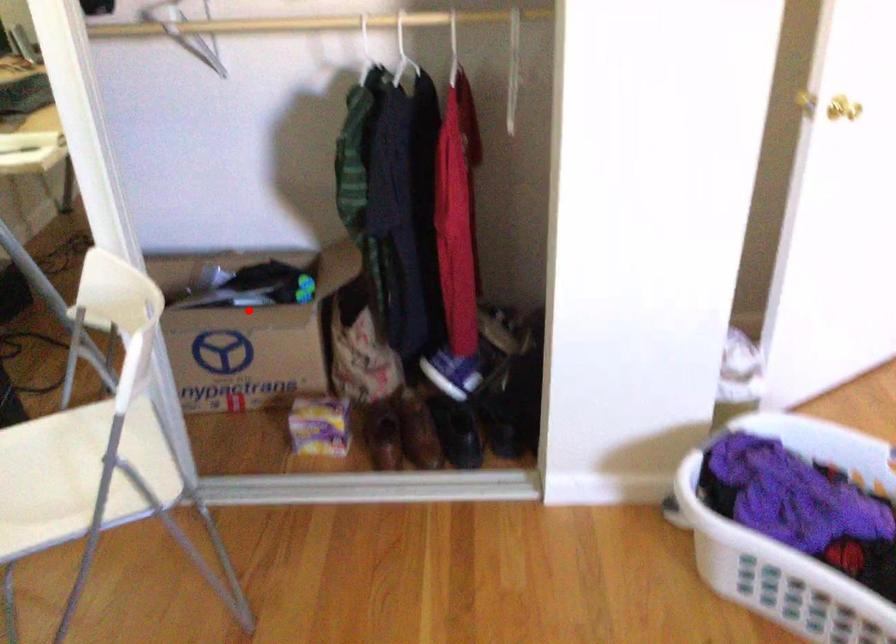
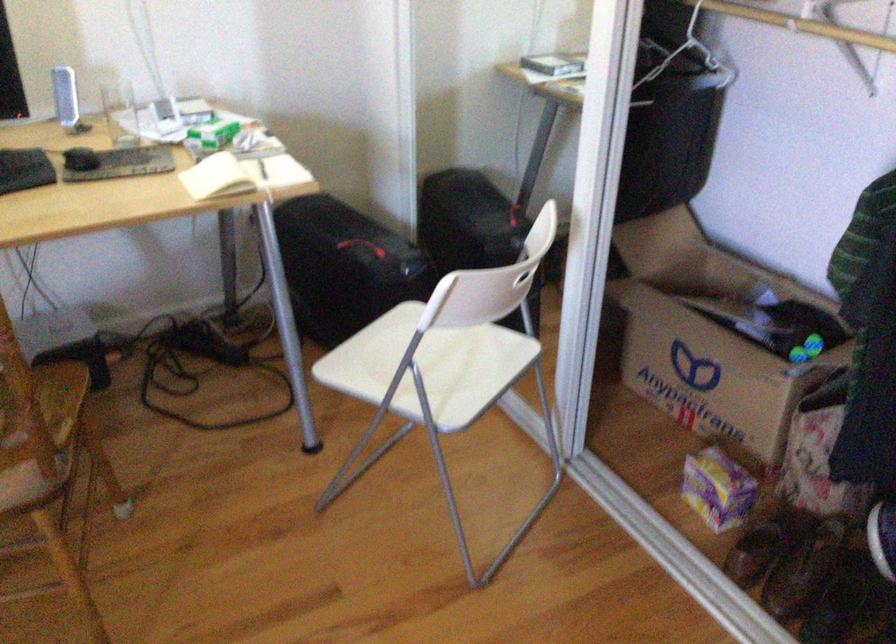
Where in the second image is the point corresponding to the highlighted location from the first image?

(708, 336)